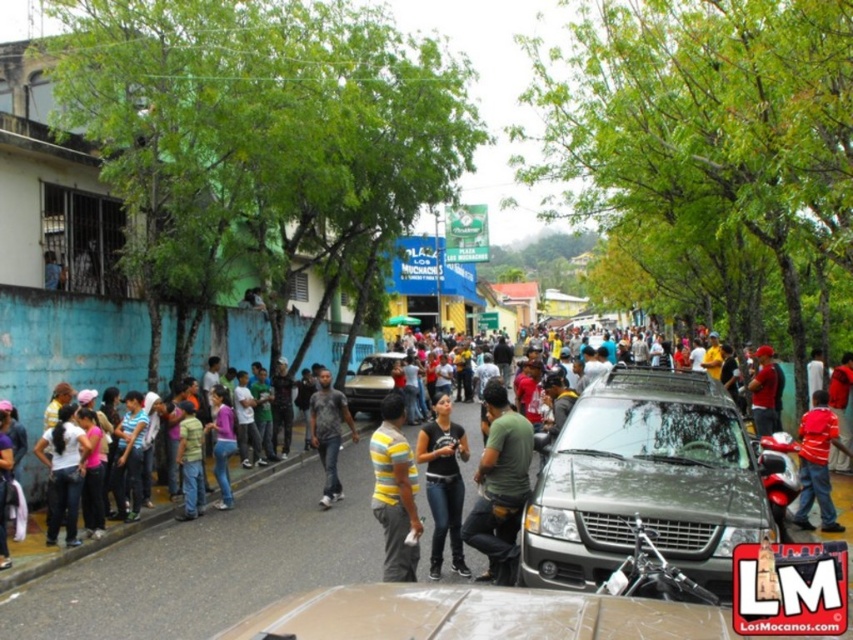
You are standing at the edge of the road in the lively street scene. You notice a person wearing a yellow striped shirt at center. Can you estimate the coordinates of this person relative to the scene?

The yellow striped shirt at center is located at coordinates point (393, 490).

You are a photographer standing on the sidewalk and want to take a photo of the yellow striped shirt at center and the black matte shirt at center. Which person should you focus on first if you want to capture both in the frame without moving the camera?

You should focus on the yellow striped shirt at center first because it is shorter than the black matte shirt at center, allowing you to frame both by adjusting the camera angle slightly upwards to include the taller person.

You are standing at the point labeled point (403, 410) and want to walk towards the point labeled point (334, 440). Which direction should you face to move directly towards your destination?

Since point (403, 410) is closer to the camera than point (334, 440), you should face towards the direction away from the camera to move directly towards point (334, 440).